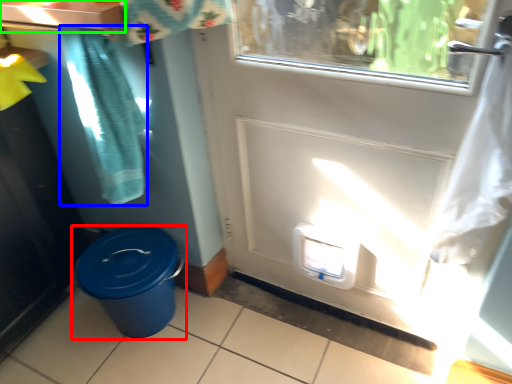
Question: Estimate the real-world distances between objects in this image. Which object is closer to waste container (highlighted by a red box), shower curtain (highlighted by a blue box) or counter top (highlighted by a green box)?

Choices:
 (A) shower curtain
 (B) counter top

Answer: (A)